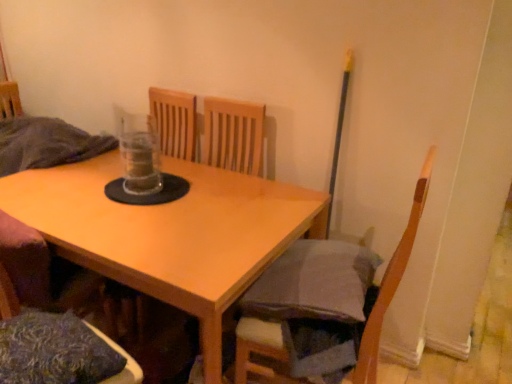
Question: Does textured blue pillow at lower left have a smaller size compared to light wood table at center?

Choices:
 (A) yes
 (B) no

Answer: (A)

Question: Is textured blue pillow at lower left to the right of light wood table at center from the viewer's perspective?

Choices:
 (A) yes
 (B) no

Answer: (B)

Question: Is textured blue pillow at lower left outside of light wood table at center?

Choices:
 (A) no
 (B) yes

Answer: (B)

Question: From a real-world perspective, is textured blue pillow at lower left located higher than light wood table at center?

Choices:
 (A) no
 (B) yes

Answer: (B)

Question: Does textured blue pillow at lower left have a greater height compared to light wood table at center?

Choices:
 (A) no
 (B) yes

Answer: (A)

Question: Is textured blue pillow at lower left shorter than light wood table at center?

Choices:
 (A) no
 (B) yes

Answer: (B)

Question: Is wooden chair at lower right, marked as the 1th chair in a right-to-left arrangement, closer to the viewer compared to light wood table at center?

Choices:
 (A) yes
 (B) no

Answer: (A)

Question: Is wooden chair at lower right, marked as the 1th chair in a right-to-left arrangement, aimed at light wood table at center?

Choices:
 (A) no
 (B) yes

Answer: (B)

Question: From the image's perspective, is wooden chair at lower right, marked as the 1th chair in a right-to-left arrangement, above light wood table at center?

Choices:
 (A) no
 (B) yes

Answer: (A)

Question: Is wooden chair at lower right, which ranks as the 2th chair in left-to-right order, located outside light wood table at center?

Choices:
 (A) no
 (B) yes

Answer: (B)

Question: Is light wood table at center surrounded by wooden chair at lower right, marked as the 1th chair in a right-to-left arrangement?

Choices:
 (A) yes
 (B) no

Answer: (B)

Question: From a real-world perspective, is wooden chair at lower right, marked as the 1th chair in a right-to-left arrangement, beneath light wood table at center?

Choices:
 (A) no
 (B) yes

Answer: (A)

Question: From a real-world perspective, does wooden chair at lower left, acting as the 2th chair starting from the right, sit lower than wooden chair at lower right, which ranks as the 2th chair in left-to-right order?

Choices:
 (A) yes
 (B) no

Answer: (B)